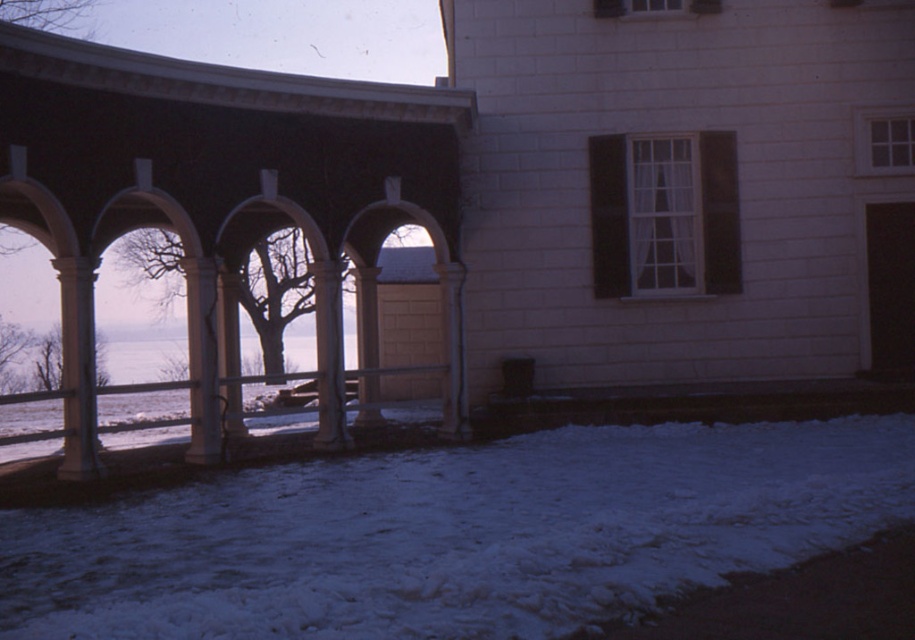
You are an architect analyzing the symmetry of the covered walkway. According to the image, which column is taller between the white stone column at left and the white stone column at center?

The white stone column at center is taller than the white stone column at left.

You are standing on the covered walkway and want to step onto the snow. Based on the scene, which object, the white fluffy snow at lower center or the white glossy column at center, is wider and thus safer to step on?

The white fluffy snow at lower center might be wider than the white glossy column at center, so stepping on the white fluffy snow at lower center would be safer as it is wider.

You are a delivery robot with a 2 meter wide package. You need to move from the snow at lower center to the building entrance behind the column at left. Can you fit through the space between the white fluffy snow at lower center and the white stone column at left?

The distance between the white fluffy snow at lower center and the white stone column at left is 5.91 meters. Since the package is 2 meters wide, there is enough space for the delivery robot to pass through.